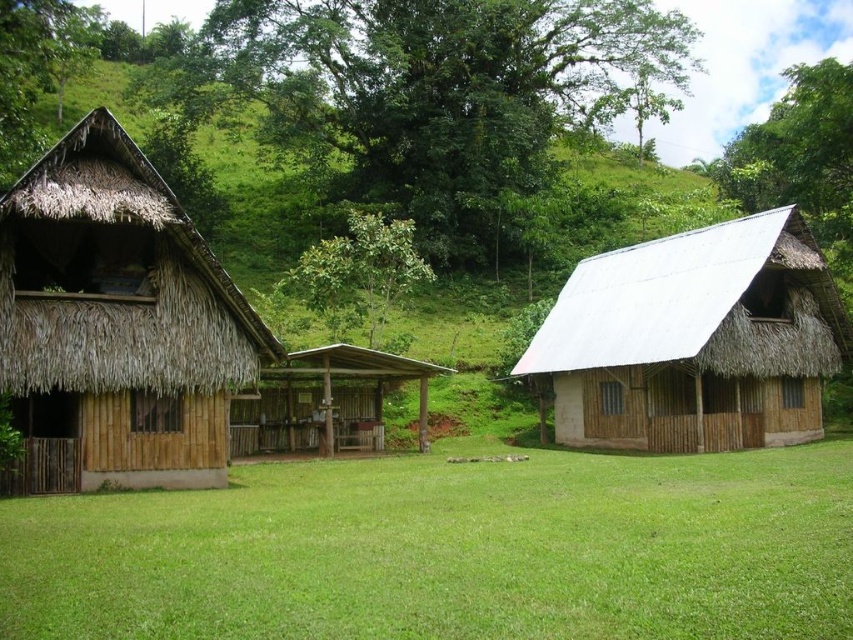
Question: Among these points, which one is farthest from the camera?

Choices:
 (A) (223, 401)
 (B) (91, 51)
 (C) (25, 508)

Answer: (B)

Question: Where is green grass at center located in relation to green leafy tree at center in the image?

Choices:
 (A) right
 (B) left

Answer: (A)

Question: Does green leafy tree at upper center have a smaller size compared to green leafy tree at center?

Choices:
 (A) no
 (B) yes

Answer: (A)

Question: Is green grass at center smaller than green leafy tree at center?

Choices:
 (A) no
 (B) yes

Answer: (B)

Question: Which object is positioned farthest from the green leafy tree at upper left?

Choices:
 (A) green leafy tree at upper center
 (B) green leafy tree at center
 (C) white thatched hut at right

Answer: (C)

Question: Which point is farther to the camera?

Choices:
 (A) (410, 266)
 (B) (550, 515)
 (C) (10, 124)
 (D) (543, 134)

Answer: (D)